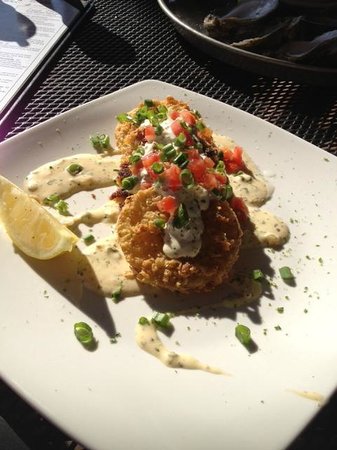
Where is `table top`? table top is located at coordinates (115, 70).